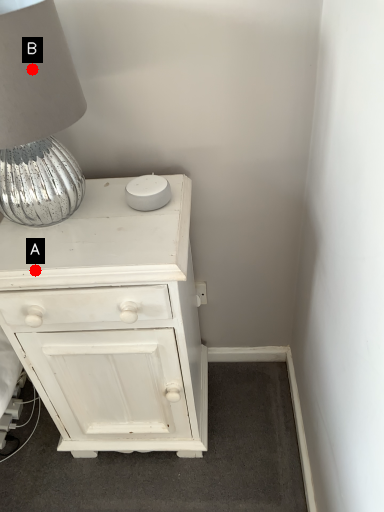
Question: Two points are circled on the image, labeled by A and B beside each circle. Which point is closer to the camera?

Choices:
 (A) A is closer
 (B) B is closer

Answer: (B)